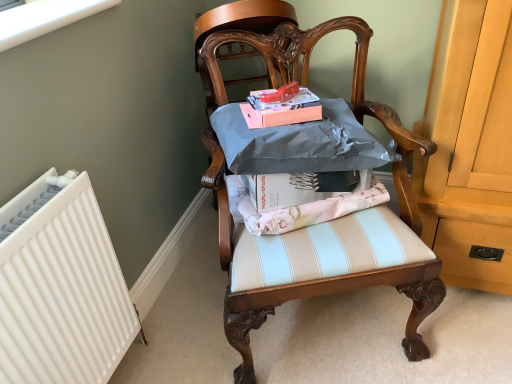
Question: Is wooden chair at center in front of or behind matte pink magazine at center in the image?

Choices:
 (A) front
 (B) behind

Answer: (A)

Question: Is wooden chair at center wider or thinner than matte pink magazine at center?

Choices:
 (A) thin
 (B) wide

Answer: (B)

Question: Which object is the farthest from the wooden chair at center?

Choices:
 (A) matte pink magazine at center
 (B) matte silver wrapping paper at center

Answer: (A)

Question: Estimate the real-world distances between objects in this image. Which object is closer to the wooden chair at center?

Choices:
 (A) matte pink magazine at center
 (B) matte silver wrapping paper at center

Answer: (B)